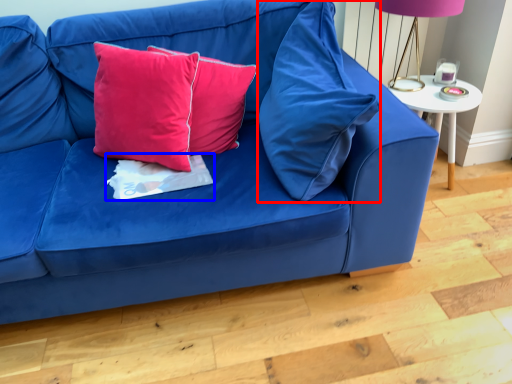
Question: Among these objects, which one is farthest to the camera, pillow (highlighted by a red box) or sheet (highlighted by a blue box)?

Choices:
 (A) pillow
 (B) sheet

Answer: (B)